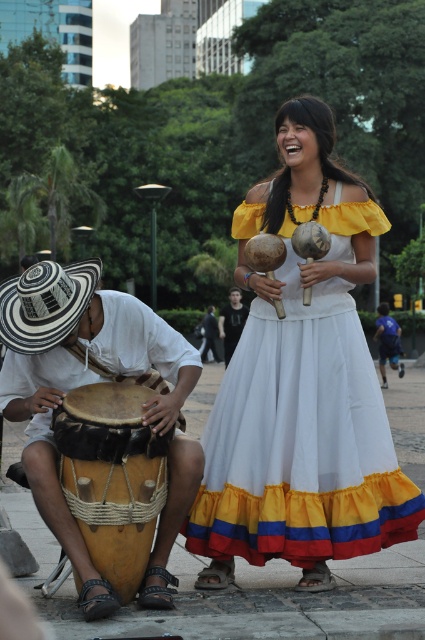
Based on the coordinates provided, which object is located at point (81, 380)?

The leather drum at lower left is located at point (81, 380).

You are a photographer standing at the edge of the performance area. You want to take a photo that includes both the white cotton dress at center and the dark brown leather drum at center. Given that your camera has a maximum focus range of 25 meters, will you be able to capture both subjects in focus without moving closer?

The white cotton dress at center is 26.92 meters from the dark brown leather drum at center. Since your camera can only focus up to 25 meters, the distance between them exceeds the focus range. Therefore, you cannot capture both subjects in focus without moving closer.